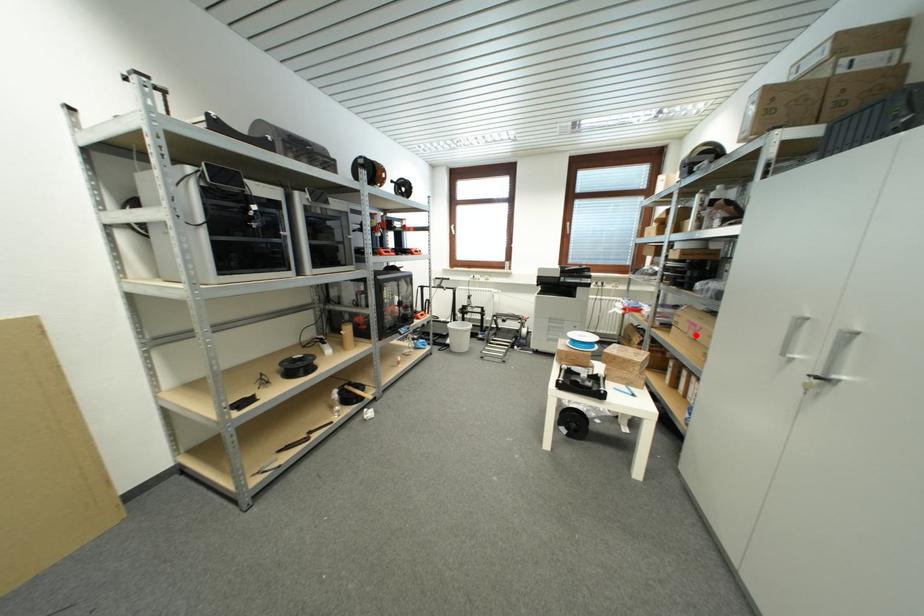
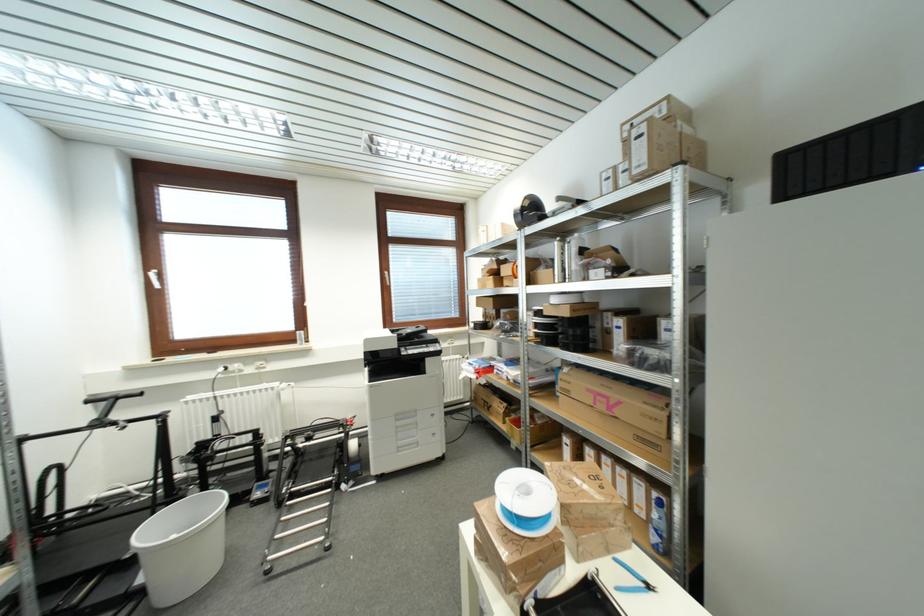
In the second image, find the point that corresponds to the highlighted location in the first image.

(605, 408)